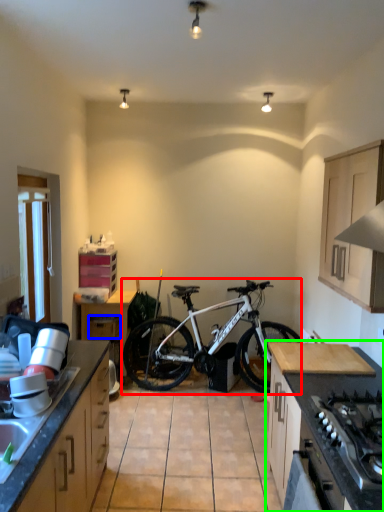
Question: Considering the real-world distances, which object is closest to bicycle (highlighted by a red box)? drawer (highlighted by a blue box) or cabinetry (highlighted by a green box).

Choices:
 (A) drawer
 (B) cabinetry

Answer: (A)